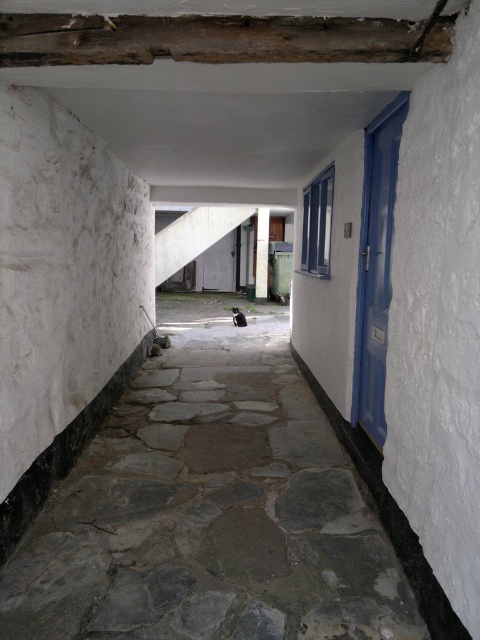
Question: Which point is farther from the camera taking this photo?

Choices:
 (A) (364, 204)
 (B) (264, 296)
 (C) (260, 481)
 (D) (84, 28)

Answer: (B)

Question: Considering the real-world distances, which object is farthest from the gray stone path at center?

Choices:
 (A) wooden beam at upper center
 (B) blue painted wood door at right
 (C) white painted wood pillar at center

Answer: (C)

Question: Does gray stone path at center lie behind blue painted wood door at right?

Choices:
 (A) no
 (B) yes

Answer: (A)

Question: Is gray stone path at center wider than wooden beam at upper center?

Choices:
 (A) no
 (B) yes

Answer: (B)

Question: Among these points, which one is farthest from the camera?

Choices:
 (A) (305, 540)
 (B) (381, 380)
 (C) (267, 212)

Answer: (C)

Question: Can you confirm if gray stone path at center is positioned to the left of white painted wood pillar at center?

Choices:
 (A) yes
 (B) no

Answer: (A)